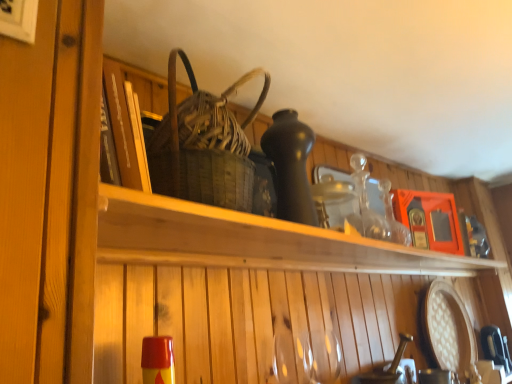
Question: Should I look upward or downward to see wooden shelf at center?

Choices:
 (A) up
 (B) down

Answer: (B)